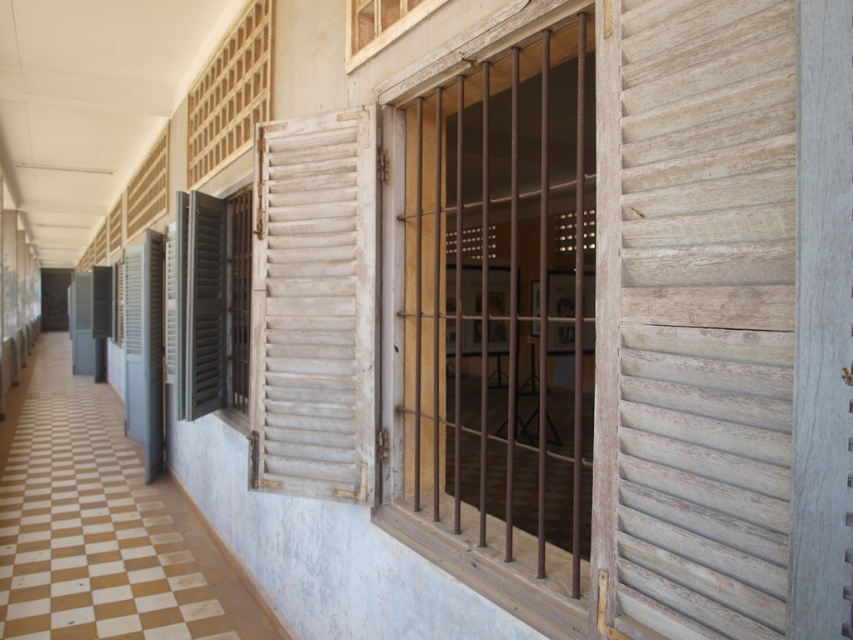
Question: Which is nearer to the brown wooden bars at center?

Choices:
 (A) white weathered wood shutter at center
 (B) weathered wood shutter at center

Answer: (A)

Question: Can you confirm if brown wooden bars at center is wider than white weathered wood shutter at center?

Choices:
 (A) no
 (B) yes

Answer: (B)

Question: Which point is closer to the camera taking this photo?

Choices:
 (A) (189, 198)
 (B) (349, 333)

Answer: (B)

Question: Is white weathered wood shutter at center to the left of gray matte shutter at left from the viewer's perspective?

Choices:
 (A) no
 (B) yes

Answer: (A)

Question: Which is nearer to the white weathered wood shutter at center?

Choices:
 (A) weathered wood shutter at center
 (B) gray matte shutter at left

Answer: (A)

Question: Is weathered wood shutter at center further to camera compared to gray matte shutter at left?

Choices:
 (A) yes
 (B) no

Answer: (B)